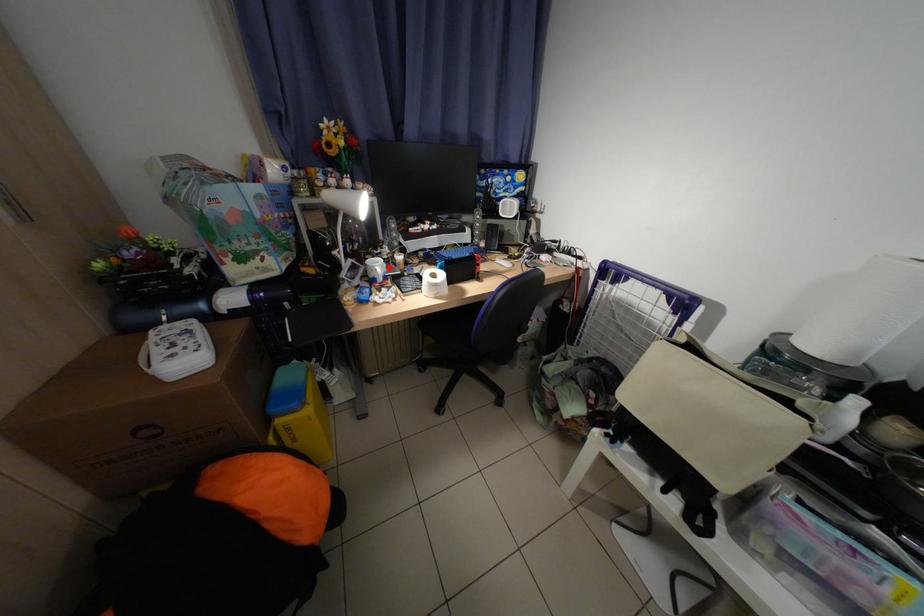
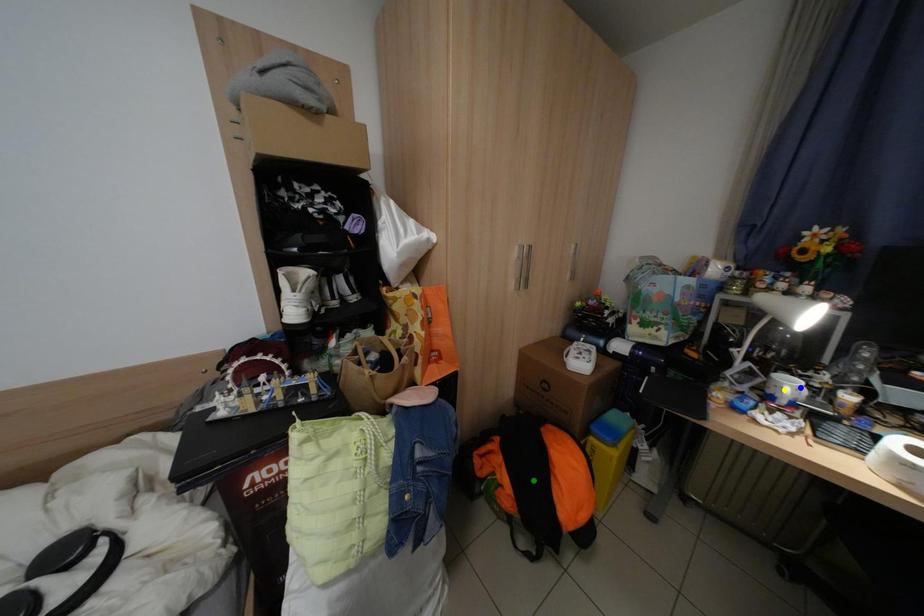
Question: I am providing you with two images of the same scene from different viewpoints. A red point is marked on the first image. You are given multiple points on the second image. Which mark in image 2 goes with the point in image 1?

Choices:
 (A) blue point
 (B) green point
 (C) yellow point

Answer: (A)